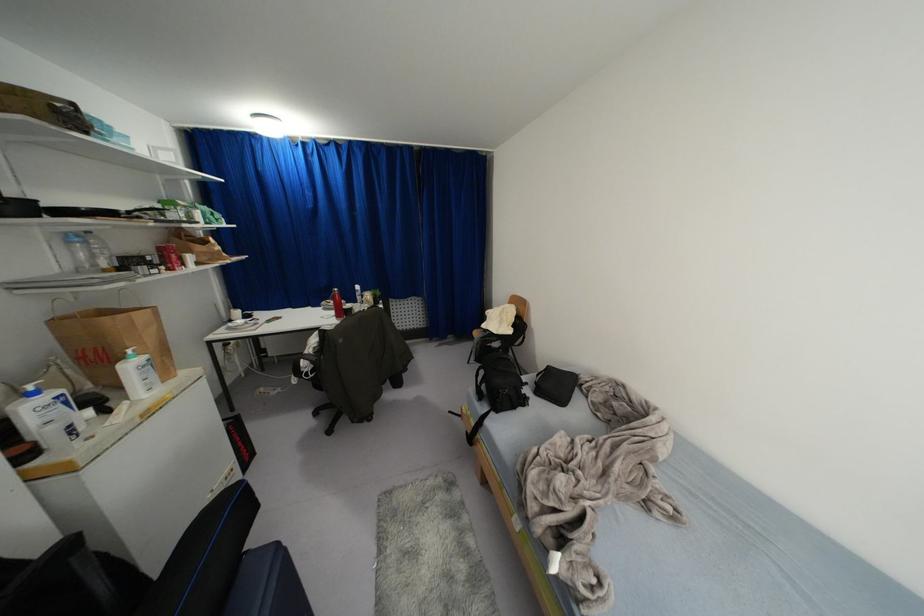
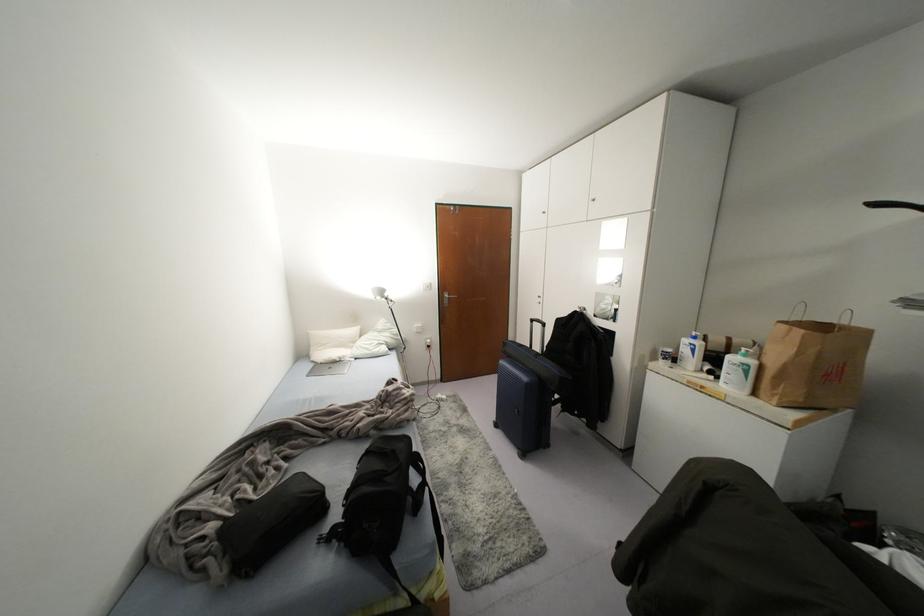
Find the pixel in the second image that matches point (65, 402) in the first image.

(691, 350)